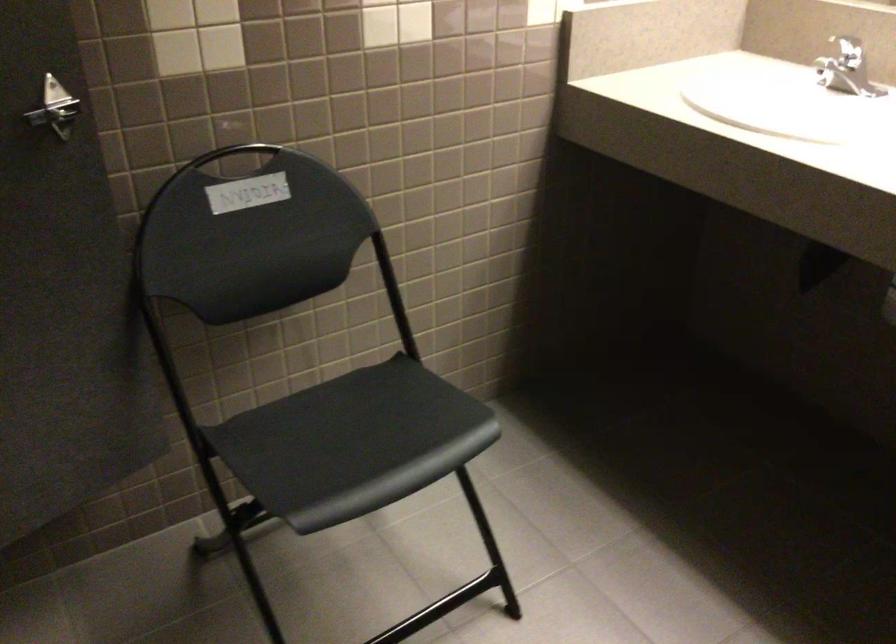
Where is `faucet handle`? The height and width of the screenshot is (644, 896). faucet handle is located at coordinates (845, 53).